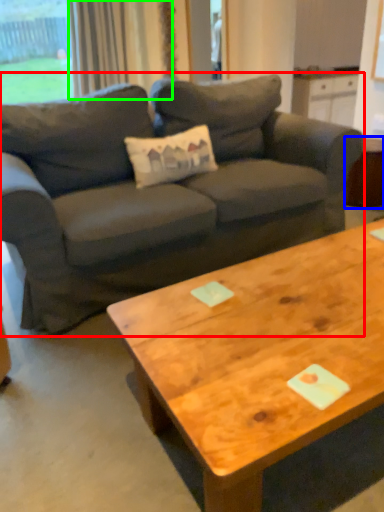
Question: Which object is positioned farthest from studio couch (highlighted by a red box)? Select from side table (highlighted by a blue box) and curtain (highlighted by a green box).

Choices:
 (A) side table
 (B) curtain

Answer: (B)